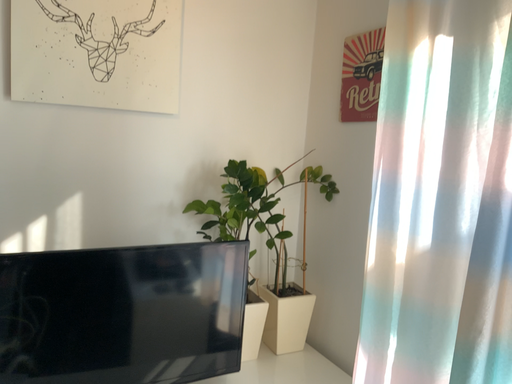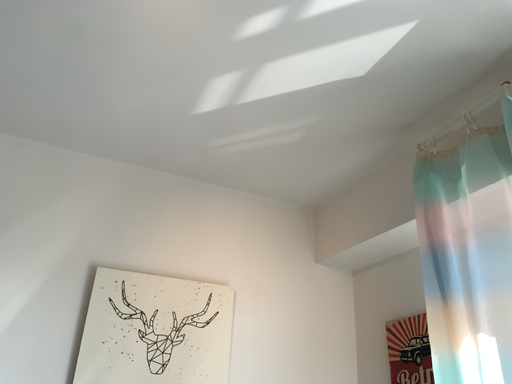
Question: How did the camera likely rotate when shooting the video?

Choices:
 (A) rotated upward
 (B) rotated downward

Answer: (A)